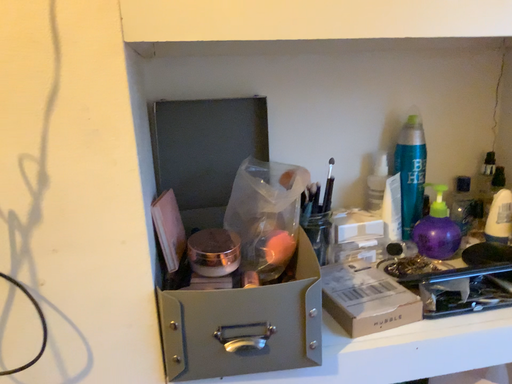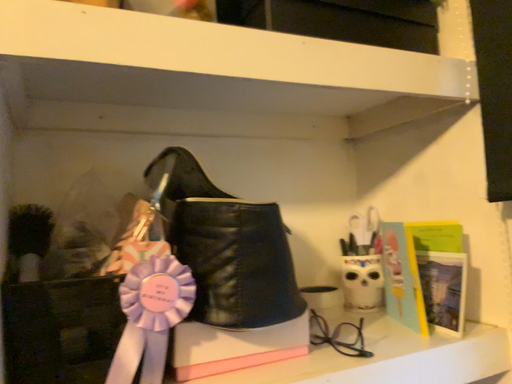
Question: Which way did the camera rotate in the video?

Choices:
 (A) rotated upward
 (B) rotated downward

Answer: (A)